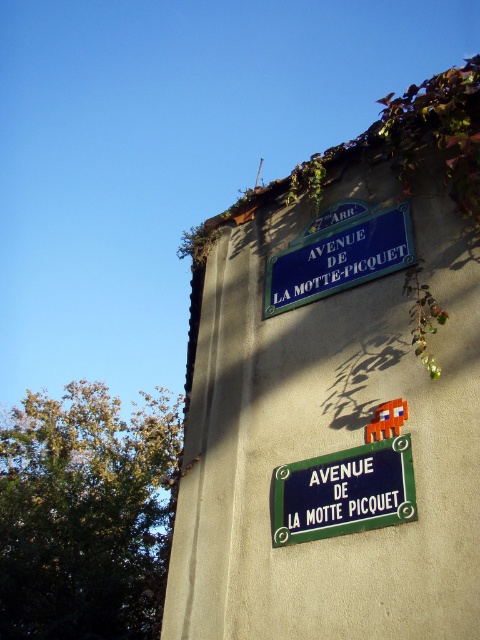
Question: Which object is the farthest from the blue plastic street sign at upper center?

Choices:
 (A) green metal street sign at upper center
 (B) green leafy ivy at upper right

Answer: (B)

Question: Which of the following is the farthest from the observer?

Choices:
 (A) (276, 282)
 (B) (48, 454)

Answer: (B)

Question: Where is green metal street sign at upper center located in relation to blue plastic street sign at upper center in the image?

Choices:
 (A) right
 (B) left

Answer: (B)

Question: Which point is farther to the camera?

Choices:
 (A) green leafy ivy at upper right
 (B) green metal street sign at upper center
 (C) blue plastic street sign at upper center

Answer: (A)

Question: Observing the image, what is the correct spatial positioning of green leafy ivy at upper right in reference to green metal street sign at upper center?

Choices:
 (A) left
 (B) right

Answer: (A)

Question: Can you confirm if green metal street sign at upper center is positioned to the right of blue plastic street sign at upper center?

Choices:
 (A) no
 (B) yes

Answer: (A)